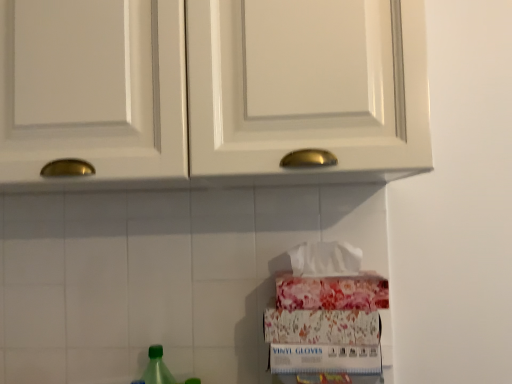
Question: Does point (184, 76) appear closer or farther from the camera than point (156, 347)?

Choices:
 (A) closer
 (B) farther

Answer: (A)

Question: From the image's perspective, is white glossy cabinet doors at upper center located above or below green matte bottle at lower left?

Choices:
 (A) below
 (B) above

Answer: (B)

Question: Based on their sizes in the image, would you say white glossy cabinet doors at upper center is bigger or smaller than green matte bottle at lower left?

Choices:
 (A) big
 (B) small

Answer: (A)

Question: Would you say green matte bottle at lower left is to the left or to the right of white glossy cabinet doors at upper center in the picture?

Choices:
 (A) left
 (B) right

Answer: (A)

Question: From the image's perspective, is green matte bottle at lower left located above or below white glossy cabinet doors at upper center?

Choices:
 (A) above
 (B) below

Answer: (B)

Question: Considering the positions of green matte bottle at lower left and white glossy cabinet doors at upper center in the image, is green matte bottle at lower left taller or shorter than white glossy cabinet doors at upper center?

Choices:
 (A) tall
 (B) short

Answer: (B)

Question: Considering the positions of point (168, 377) and point (201, 24), is point (168, 377) closer or farther from the camera than point (201, 24)?

Choices:
 (A) closer
 (B) farther

Answer: (B)